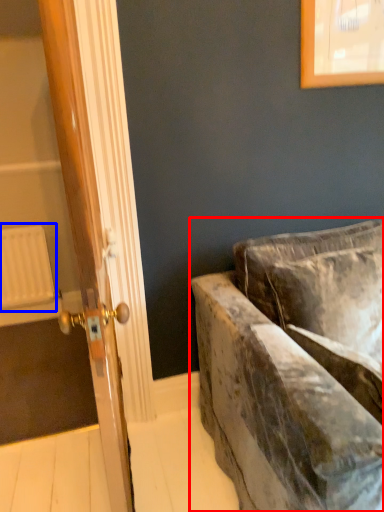
Question: Which of the following is the farthest to the observer, studio couch (highlighted by a red box) or radiator (highlighted by a blue box)?

Choices:
 (A) studio couch
 (B) radiator

Answer: (B)